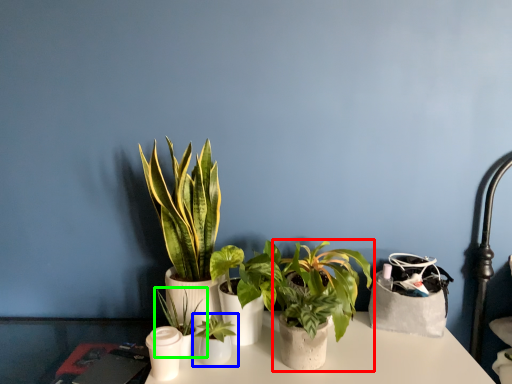
Question: Estimate the real-world distances between objects in this image. Which object is farther from houseplant (highlighted by a red box), houseplant (highlighted by a blue box) or houseplant (highlighted by a green box)?

Choices:
 (A) houseplant
 (B) houseplant

Answer: (B)